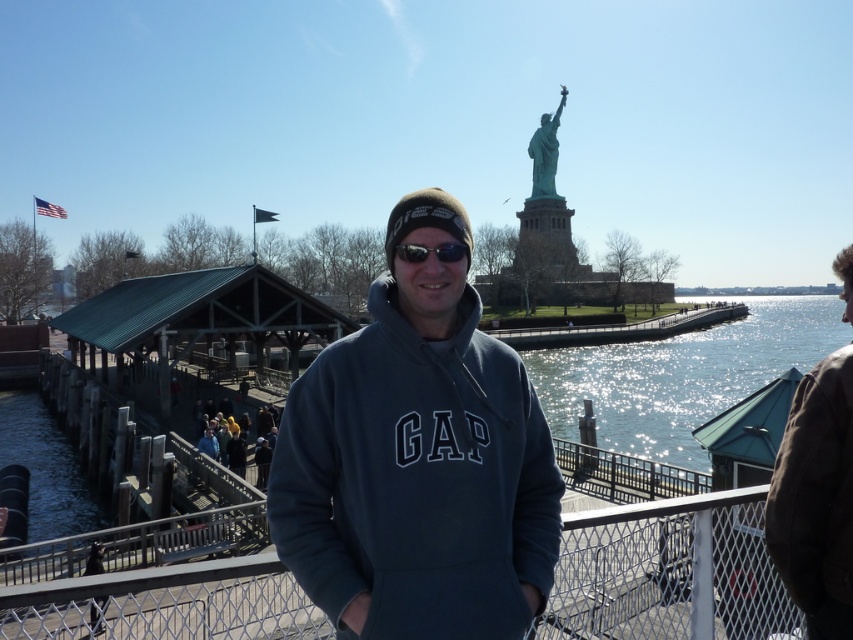
Which is in front, point (546, 148) or point (260, 465)?

Positioned in front is point (260, 465).

Is point (550, 134) positioned before point (229, 429)?

No, (550, 134) is behind (229, 429).

Where is `green patina statue at upper center`? The image size is (853, 640). green patina statue at upper center is located at coordinates (544, 150).

Is brown leather jacket at right wider than green patina statue at upper center?

Incorrect, brown leather jacket at right's width does not surpass green patina statue at upper center's.

Between brown leather jacket at right and green patina statue at upper center, which one appears on the left side from the viewer's perspective?

brown leather jacket at right is more to the left.

Locate an element on the screen. The image size is (853, 640). brown leather jacket at right is located at coordinates coord(816,499).

The width and height of the screenshot is (853, 640). Find the location of `brown leather jacket at right`. brown leather jacket at right is located at coordinates (816, 499).

Can you confirm if metallic chain-link fence at center is positioned to the right of brown leather jacket at right?

Incorrect, metallic chain-link fence at center is not on the right side of brown leather jacket at right.

Find the location of `metallic chain-link fence at center`. metallic chain-link fence at center is located at coordinates (669, 572).